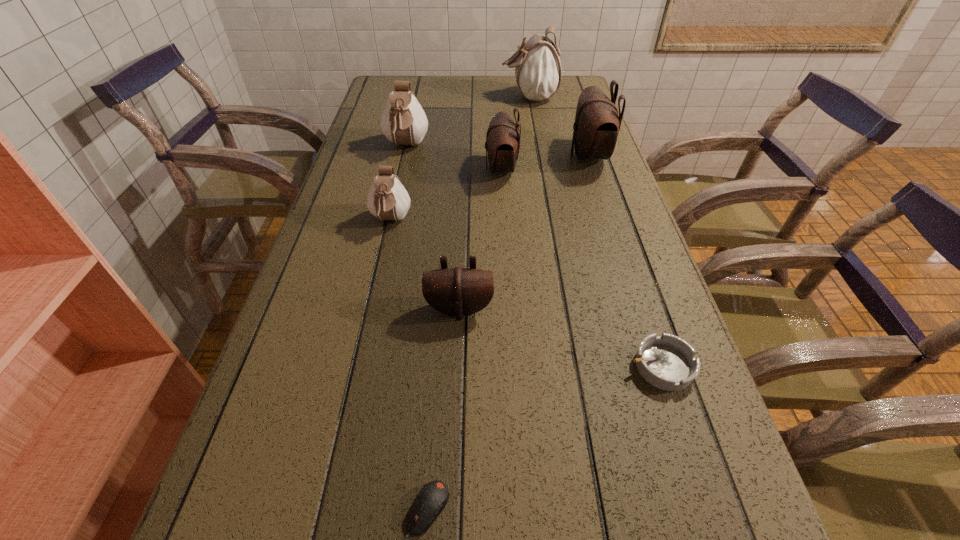
This screenshot has width=960, height=540. I want to click on vacant space at the far right corner of the desktop, so click(584, 83).

Find the location of a particular element. Image resolution: width=960 pixels, height=540 pixels. free space between the ashtray and the rightmost white pouch is located at coordinates (595, 232).

The width and height of the screenshot is (960, 540). I want to click on unoccupied position between the rightmost white pouch and the nearest brown pouch, so click(494, 203).

This screenshot has width=960, height=540. Identify the location of free space between the biggest brown pouch and the fifth farthest pouch. (490, 188).

What are the coordinates of `free point between the second shortest object and the second smallest brown pouch` in the screenshot? It's located at (581, 267).

Find the location of a particular element. The height and width of the screenshot is (540, 960). free space that is in between the fifth farthest pouch and the second nearest object is located at coordinates (526, 293).

At what (x,y) coordinates should I click in order to perform the action: click on empty location between the biggest white pouch and the second smallest white pouch. Please return your answer as a coordinate pair (x, y). Looking at the image, I should click on (468, 122).

Identify the location of vacant area between the rightmost brown pouch and the nearest brown pouch. This screenshot has height=540, width=960. (524, 232).

Locate an element on the screen. object that is the sixth closest to the computer mouse is located at coordinates (404, 122).

The width and height of the screenshot is (960, 540). In order to click on object that is the third closest to the shortest object in this screenshot , I will do `click(387, 199)`.